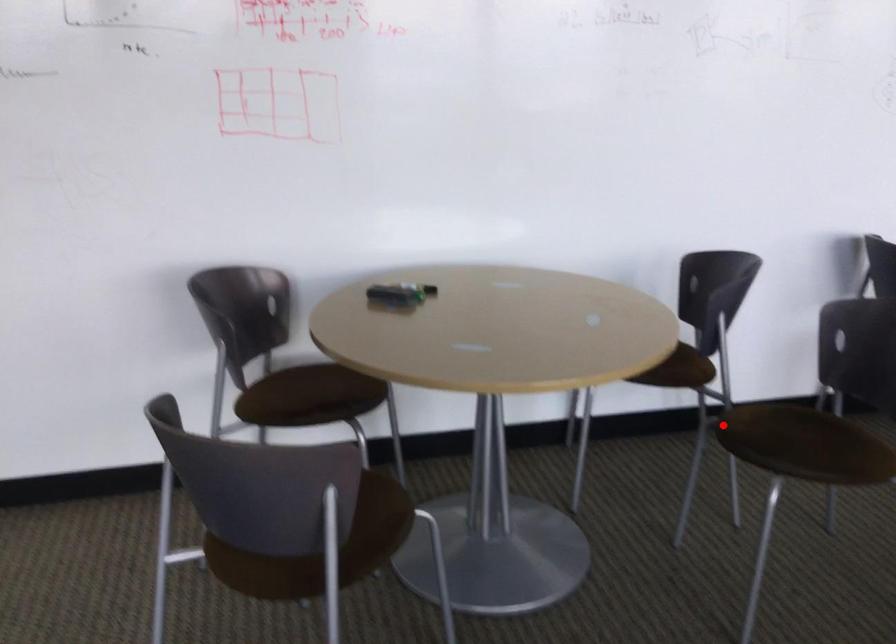
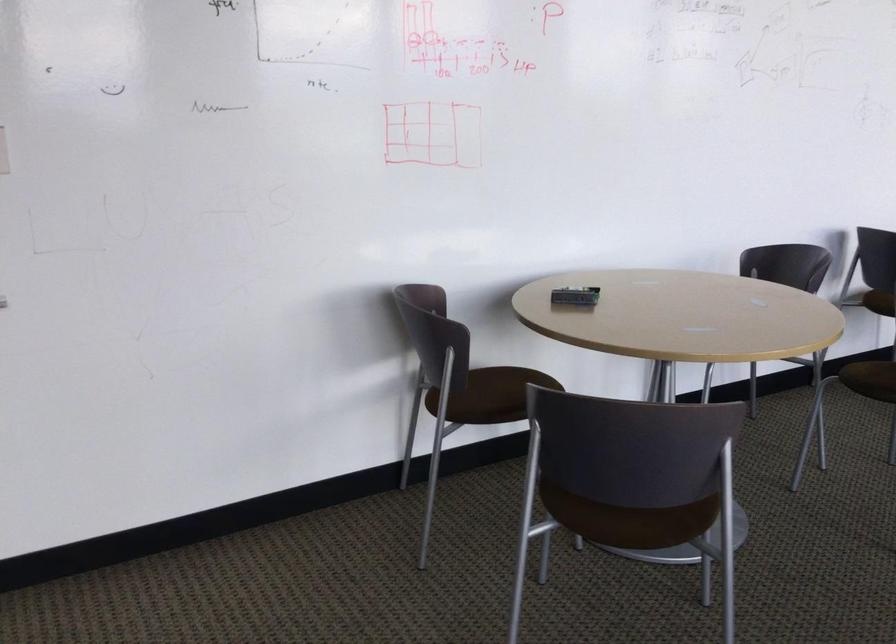
In the second image, find the point that corresponds to the highlighted location in the first image.

(872, 379)